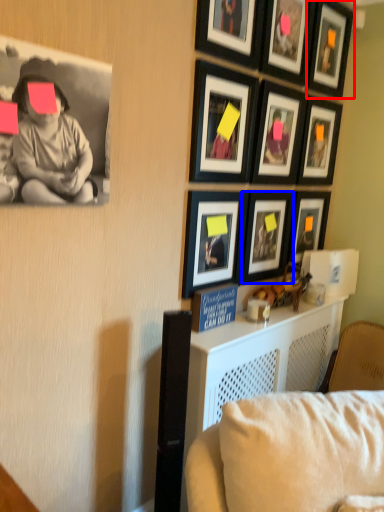
Question: Which point is closer to the camera, picture frame (highlighted by a red box) or picture frame (highlighted by a blue box)?

Choices:
 (A) picture frame
 (B) picture frame

Answer: (B)